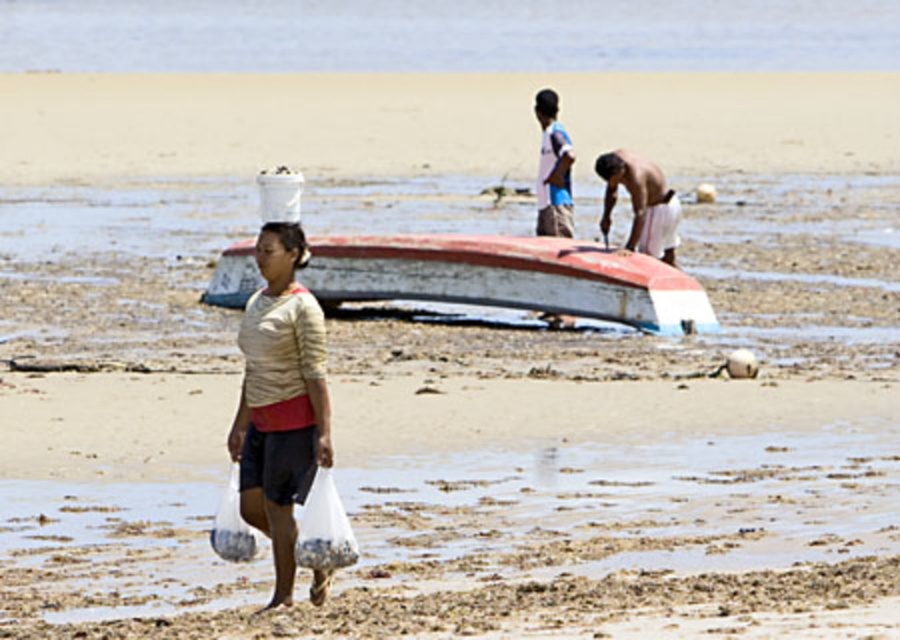
Between matte beige shirt at center and shiny white sand at center, which one is positioned lower?

matte beige shirt at center is below.

In the scene shown: Does matte beige shirt at center have a smaller size compared to shiny white sand at center?

Correct, matte beige shirt at center occupies less space than shiny white sand at center.

The height and width of the screenshot is (640, 900). What are the coordinates of `matte beige shirt at center` in the screenshot? It's located at (280, 400).

Is matte beige shirt at center positioned in front of light blue fabric shirt at center?

Yes.

Image resolution: width=900 pixels, height=640 pixels. What do you see at coordinates (280, 400) in the screenshot? I see `matte beige shirt at center` at bounding box center [280, 400].

Image resolution: width=900 pixels, height=640 pixels. In order to click on matte beige shirt at center in this screenshot , I will do `click(280, 400)`.

Is point (266, 40) closer to viewer compared to point (216, 296)?

That is False.

Which is more to the right, clear water at upper left or rusty wood boat at center?

From the viewer's perspective, clear water at upper left appears more on the right side.

Locate an element on the screen. The width and height of the screenshot is (900, 640). clear water at upper left is located at coordinates (447, 35).